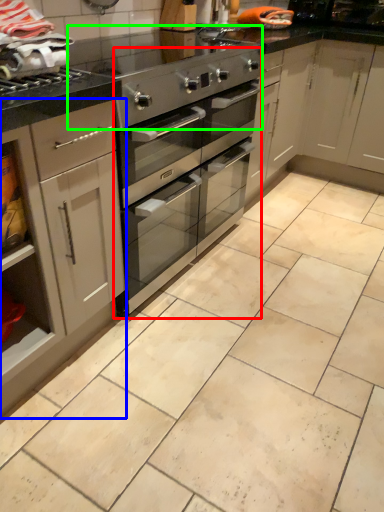
Question: Which object is the closest to the oven (highlighted by a red box)? Choose among these: cabinetry (highlighted by a blue box) or appliance (highlighted by a green box).

Choices:
 (A) cabinetry
 (B) appliance

Answer: (B)